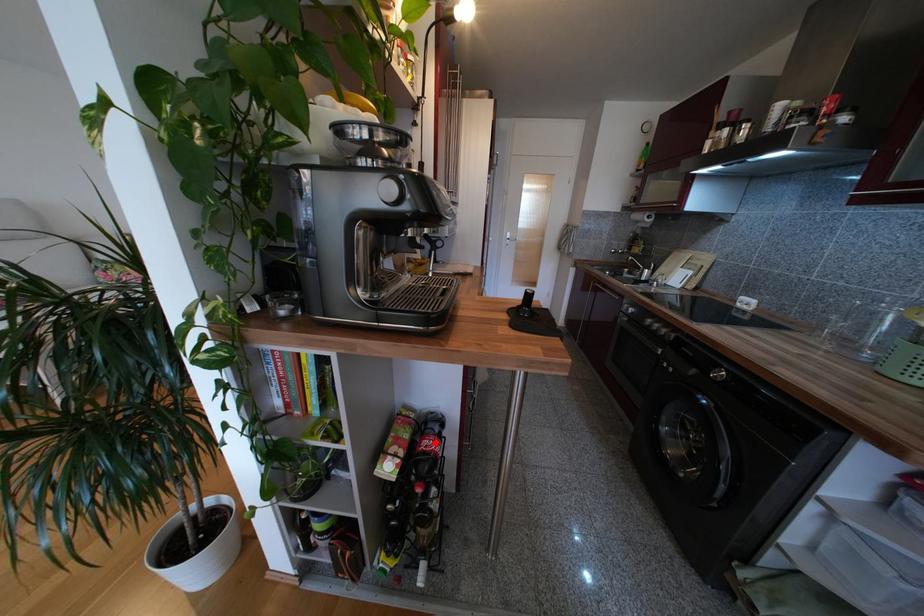
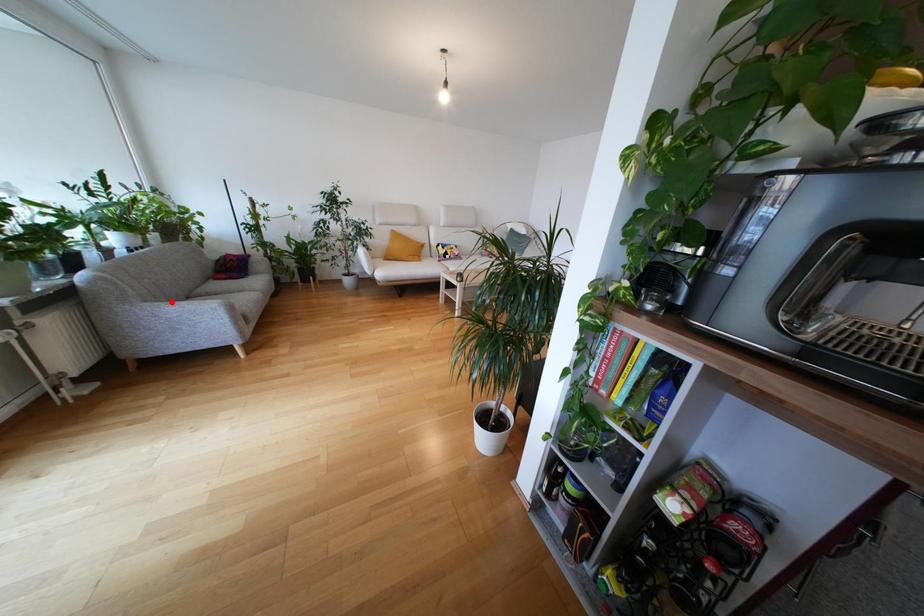
I am providing you with two images of the same scene from different viewpoints. A red point is marked on the first image and another point is marked on the second image. Does the point marked in image1 correspond to the same location as the one in image2?

No